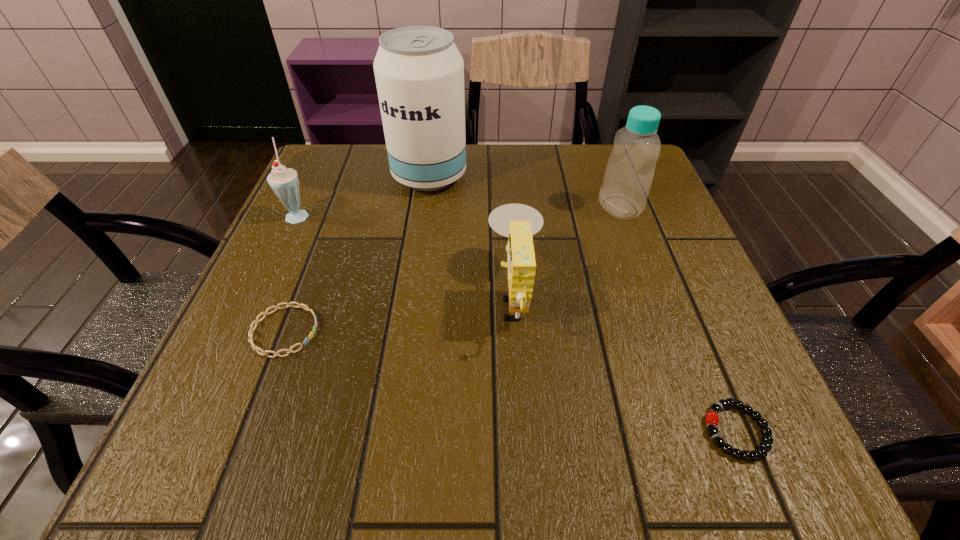
Identify the location of free space between the sponge and the left bracelet. Image resolution: width=960 pixels, height=540 pixels. (399, 313).

Image resolution: width=960 pixels, height=540 pixels. In order to click on object that is the fourth nearest to the milkshake in this screenshot , I will do `click(629, 173)`.

Locate an element on the screen. The image size is (960, 540). the fifth closest object relative to the alcohol is located at coordinates (712, 418).

Find the location of a particular element. The width and height of the screenshot is (960, 540). vacant region that satisfies the following two spatial constraints: 1. on the front side of the second tallest object; 2. on the front-facing side of the sponge is located at coordinates (652, 295).

Identify the location of vacant region that satisfies the following two spatial constraints: 1. on the front-facing side of the third object from right to left; 2. on the back side of the right bracelet. (525, 431).

Find the location of `free point that satisfies the following two spatial constraints: 1. on the front side of the second tallest object; 2. on the surface of the farther bracelet showing star-shaped elements`. free point that satisfies the following two spatial constraints: 1. on the front side of the second tallest object; 2. on the surface of the farther bracelet showing star-shaped elements is located at coordinates (664, 331).

At what (x,y) coordinates should I click in order to perform the action: click on vacant position in the image that satisfies the following two spatial constraints: 1. on the straw side of the nearer bracelet; 2. on the left side of the milkshake. Please return your answer as a coordinate pair (x, y). The width and height of the screenshot is (960, 540). Looking at the image, I should click on (198, 431).